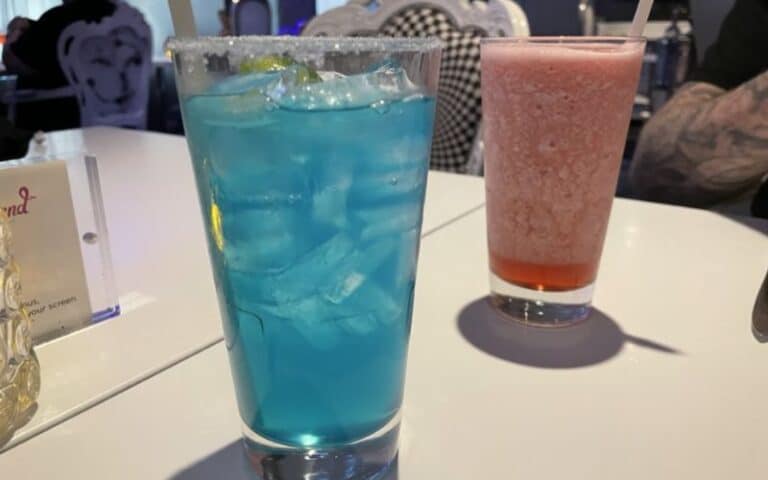
Locate an element on the screen. The image size is (768, 480). decorated chair is located at coordinates (464, 48), (116, 53).